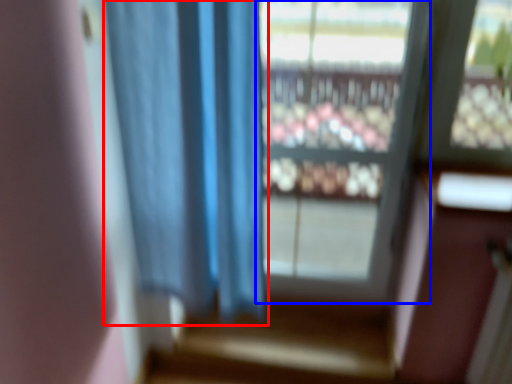
Question: Among these objects, which one is nearest to the camera, curtain (highlighted by a red box) or window (highlighted by a blue box)?

Choices:
 (A) curtain
 (B) window

Answer: (A)